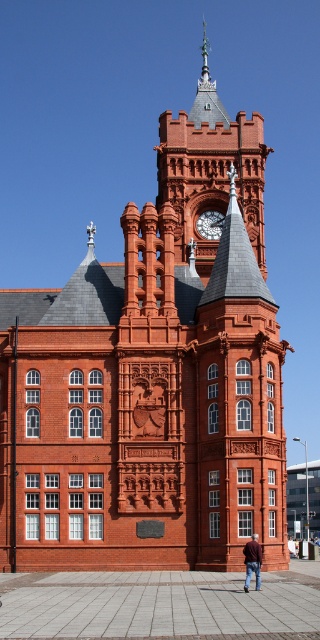
You are standing in front of the red brick building and see the brown leather jacket at lower center and the polished brass clock at upper center. Which object is positioned to the left of the other?

The brown leather jacket at lower center is to the left of the polished brass clock at upper center.

You are standing in front of the red brick building and notice two items of interest. You see the brown leather jacket at lower center and the polished brass clock at upper center. Which object is located closer to the ground?

The brown leather jacket at lower center is positioned under the polished brass clock at upper center, so it is closer to the ground.

You are standing in front of the red brick building with the clock tower. You notice two points marked on the building facade. The first point is at coordinates point [256,548] and the second point is at point [213,216]. From your perspective, which point appears closer to you?

Point [256,548] is in front of point [213,216], so it appears closer to you.